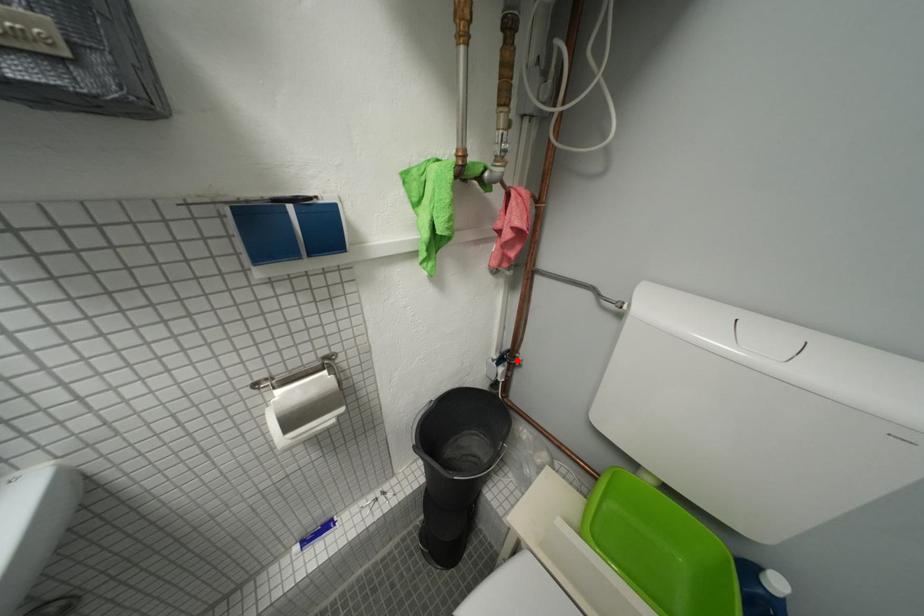
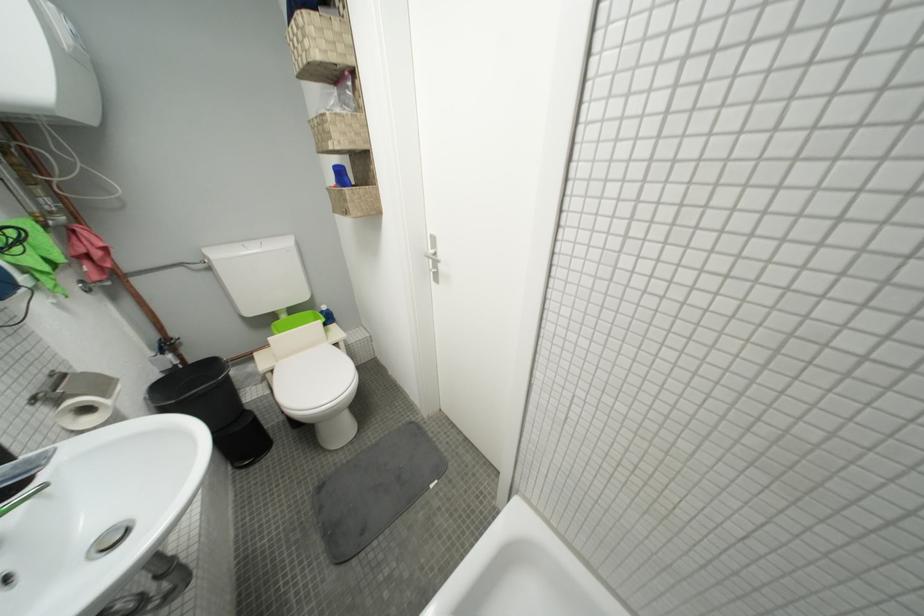
The point at the highlighted location is marked in the first image. Where is the corresponding point in the second image?

(175, 347)